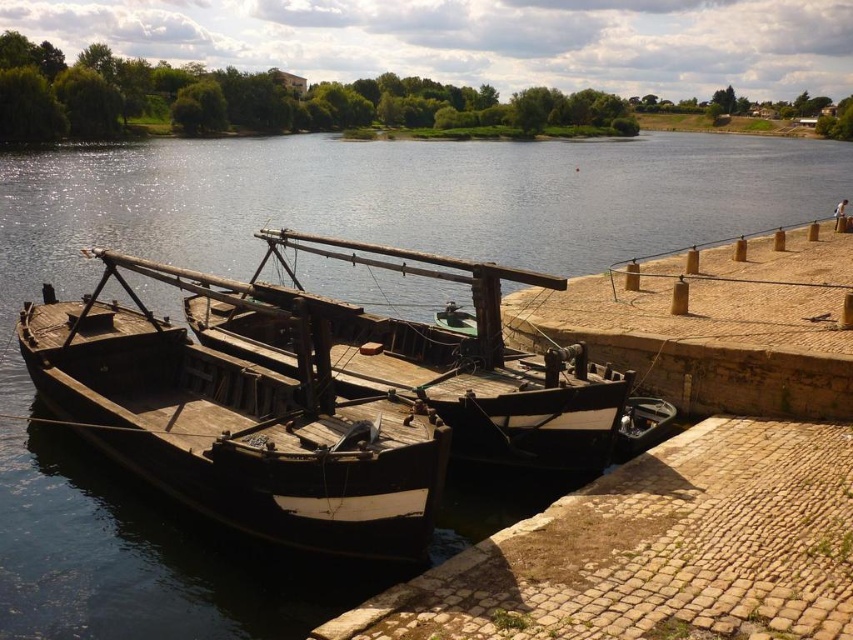
You are standing on the wooden boat at left and want to walk to the brown stone dock at right. Is the dock higher than the boat?

The wooden boat at left is below the brown stone dock at right, so yes, the dock is higher than the boat.